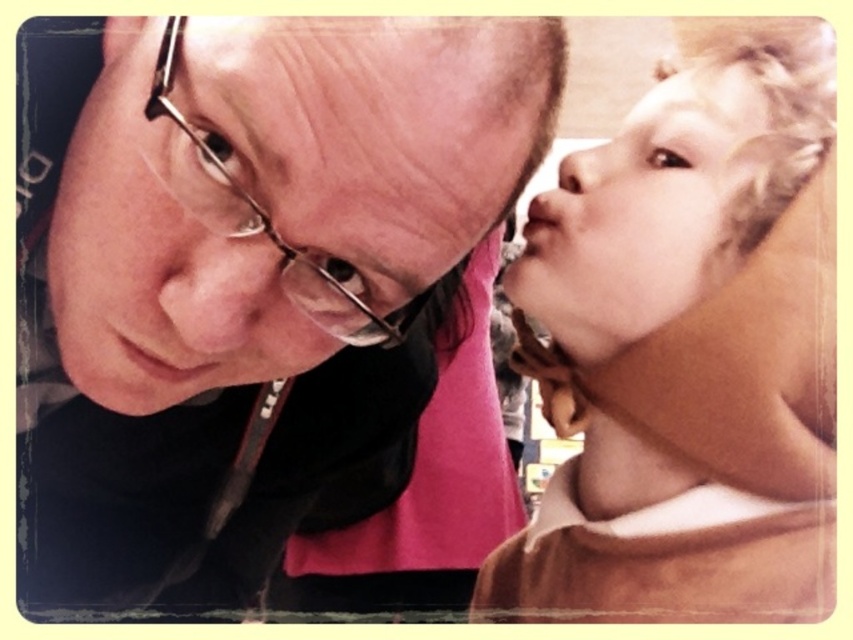
You are a photographer who needs to adjust the focus of your camera to capture both the blonde hair at upper right and the metallic frame glasses at upper left in the same shot. Which object should you focus on first to ensure both are in focus?

You should focus on the metallic frame glasses at upper left first because it is shorter than the blonde hair at upper right, allowing the depth of field to cover both objects effectively.

You are standing in the scene and want to touch both the point at coordinates point [515,579] and point [575,163]. Which point will require you to reach further away from your body?

The point at coordinates point [515,579] is further to the camera than point [575,163], so you will need to reach further away from your body to touch point [515,579].